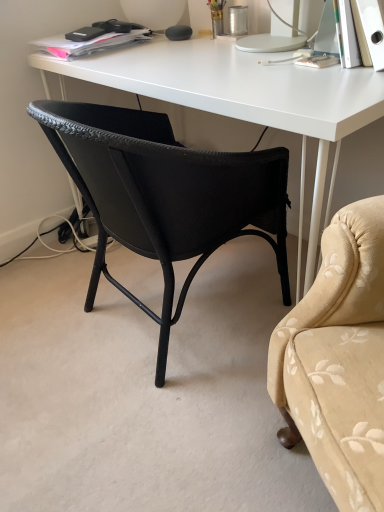
Find the location of a particular element. free area in between black woven chair at center and white matte desk at center is located at coordinates (100, 277).